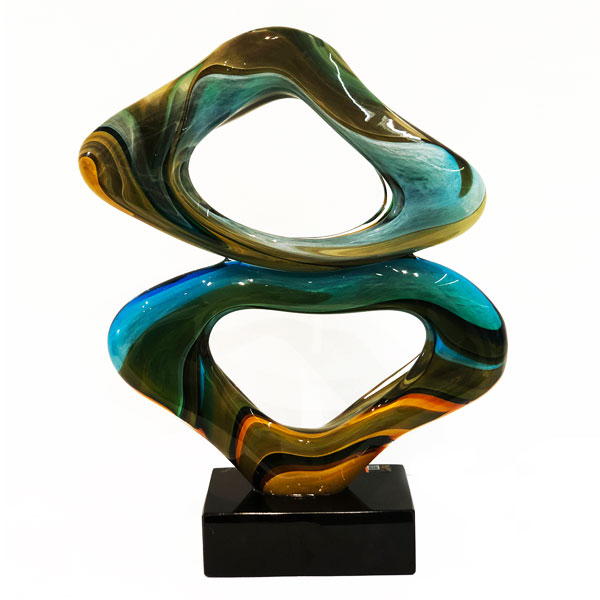
What are the coordinates of `ceramic artwork` in the screenshot? It's located at (317, 487).